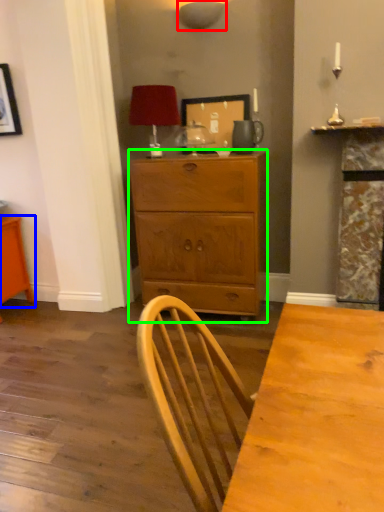
Question: Which object is positioned closest to lamp (highlighted by a red box)? Select from vanity (highlighted by a blue box) and chest of drawers (highlighted by a green box).

Choices:
 (A) vanity
 (B) chest of drawers

Answer: (B)